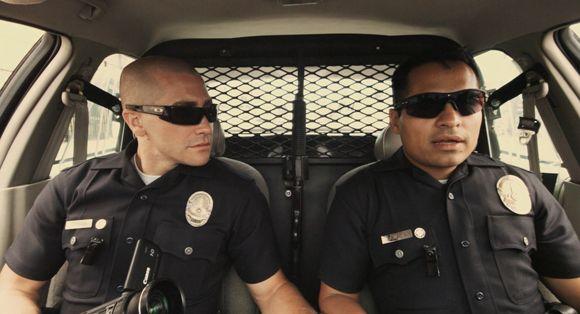
What are the coordinates of `seats` in the screenshot? It's located at (326, 209), (280, 194).